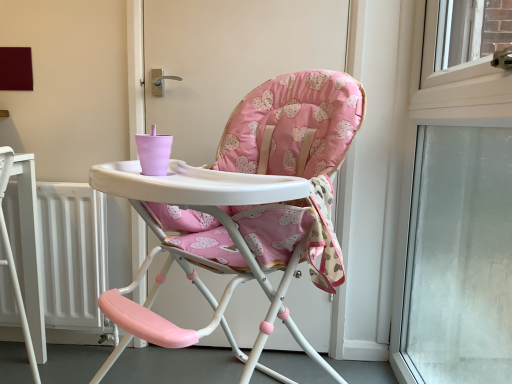
Question: Should I look upward or downward to see white matte radiator at lower left?

Choices:
 (A) down
 (B) up

Answer: (A)

Question: From the image's perspective, is transparent glass window at right over white matte radiator at lower left?

Choices:
 (A) no
 (B) yes

Answer: (B)

Question: Would you say transparent glass window at right contains white matte radiator at lower left?

Choices:
 (A) no
 (B) yes

Answer: (A)

Question: Are transparent glass window at right and white matte radiator at lower left located far from each other?

Choices:
 (A) yes
 (B) no

Answer: (A)

Question: Can we say transparent glass window at right lies outside white matte radiator at lower left?

Choices:
 (A) yes
 (B) no

Answer: (A)

Question: Can you confirm if transparent glass window at right is shorter than white matte radiator at lower left?

Choices:
 (A) yes
 (B) no

Answer: (B)

Question: Considering the relative sizes of transparent glass window at right and white matte radiator at lower left in the image provided, is transparent glass window at right thinner than white matte radiator at lower left?

Choices:
 (A) no
 (B) yes

Answer: (A)

Question: Considering the relative sizes of pink fabric highchair at center and white matte radiator at lower left in the image provided, is pink fabric highchair at center smaller than white matte radiator at lower left?

Choices:
 (A) no
 (B) yes

Answer: (A)

Question: Does pink fabric highchair at center lie behind white matte radiator at lower left?

Choices:
 (A) no
 (B) yes

Answer: (A)

Question: Considering the relative sizes of pink fabric highchair at center and white matte radiator at lower left in the image provided, is pink fabric highchair at center wider than white matte radiator at lower left?

Choices:
 (A) no
 (B) yes

Answer: (A)

Question: From the image's perspective, is pink fabric highchair at center located beneath white matte radiator at lower left?

Choices:
 (A) yes
 (B) no

Answer: (B)

Question: Can you confirm if pink fabric highchair at center is thinner than white matte radiator at lower left?

Choices:
 (A) no
 (B) yes

Answer: (B)

Question: From a real-world perspective, is pink fabric highchair at center on top of white matte radiator at lower left?

Choices:
 (A) no
 (B) yes

Answer: (B)

Question: Can we say white matte radiator at lower left lies outside transparent glass window at right?

Choices:
 (A) no
 (B) yes

Answer: (B)